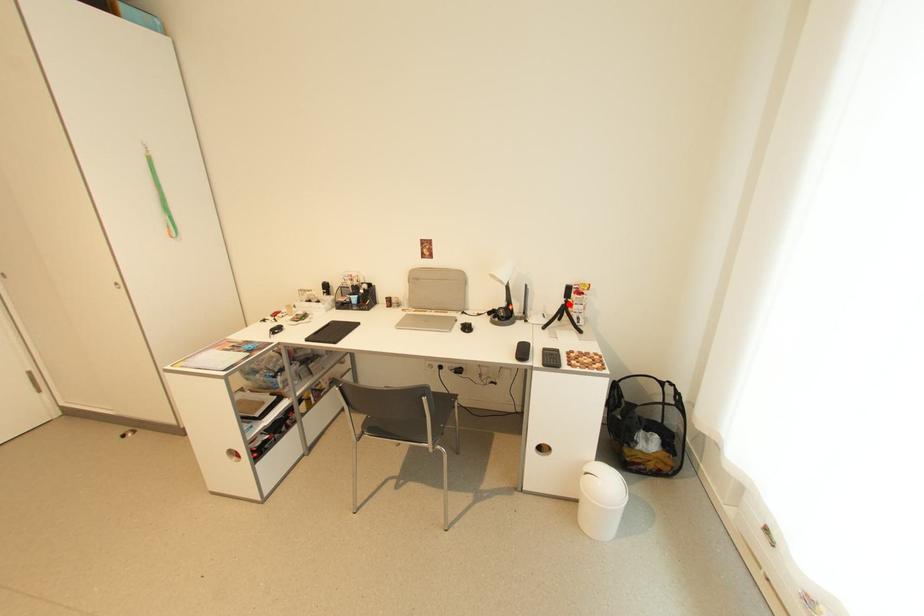
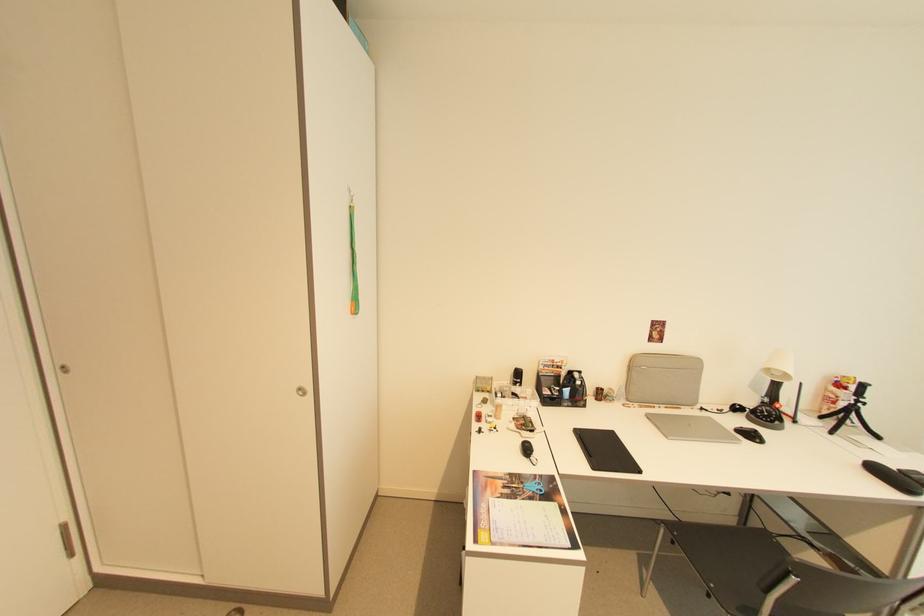
Where in the second image is the point corresponding to the highlighted location from the first image?

(857, 405)